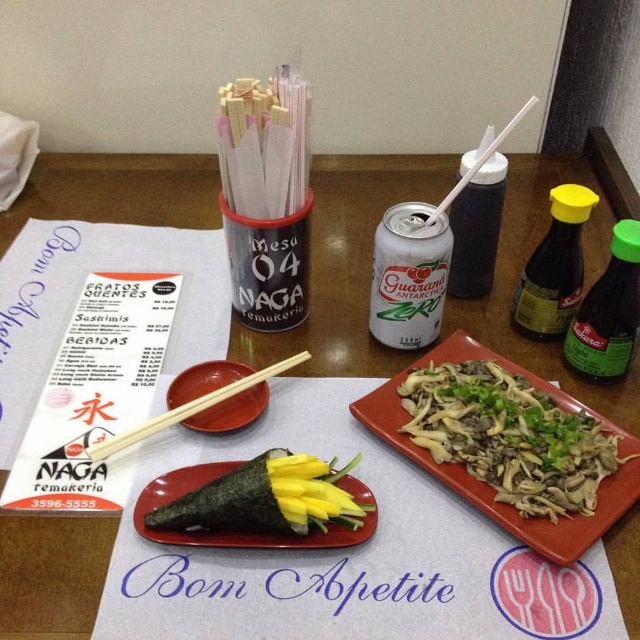
Consider the image. You are a customer at Naga Remakeria and want to locate the green leafy vegetables at center. According to the coordinates provided, where exactly would you find them on the table?

The green leafy vegetables at center are located at coordinates point (509, 436) on the table.

You are a diner at the sushi restaurant and want to place a small condiment between the green leafy vegetables at center and the dark brown glass soy sauce at right. Based on their sizes, can you fit it there?

The green leafy vegetables at center has a larger width than the dark brown glass soy sauce at right, so there might be enough space to fit a small condiment between them.

You are a guest at Naga Remakeria and see both the matte wood chopsticks at center and the wooden chopsticks at center on the table. Which set is positioned more to the right?

The matte wood chopsticks at center are more to the right than the wooden chopsticks at center.